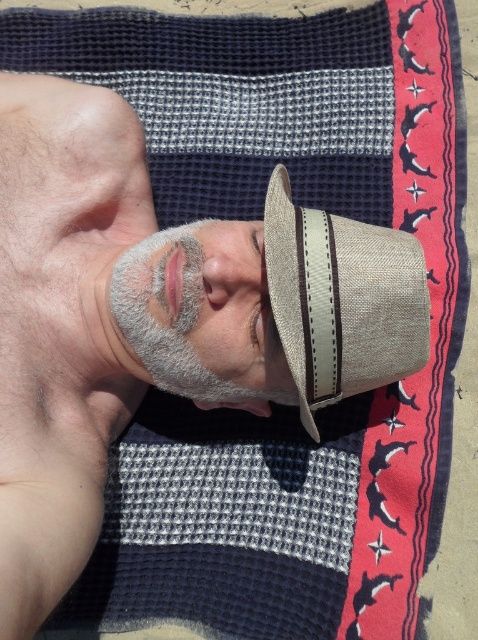
Does beige straw hat at center appear over gray fabric face mask at center?

Yes, beige straw hat at center is above gray fabric face mask at center.

Where is `beige straw hat at center`? The width and height of the screenshot is (478, 640). beige straw hat at center is located at coordinates (341, 300).